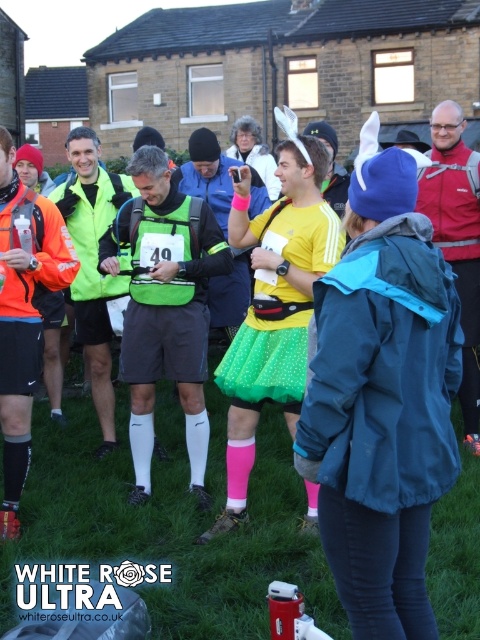
You are a photographer at the event and want to capture both the green polka dot skirt at center and the green tulle skirt at center in the same frame. Given that your camera has a maximum focus range of 5 feet, will you be able to include both in the shot?

The green polka dot skirt at center and the green tulle skirt at center are 5.50 feet apart. Since the distance between them exceeds the camera focus range of 5 feet, you cannot include both in the same frame.

You are a photographer at the event and want to capture a photo of the green tulle skirt at center and the green matte vest at center. Which piece of clothing should you focus on first if you want to highlight the shorter one?

The green tulle skirt at center is shorter than the green matte vest at center, so you should focus on the green tulle skirt at center first to highlight its shorter length.

You are standing in the middle of the running event crowd and want to move towards the two points marked in the image. Which point, point (344, 456) or point (177, 243), is closer to you?

Point (344, 456) is closer to you than point (177, 243).